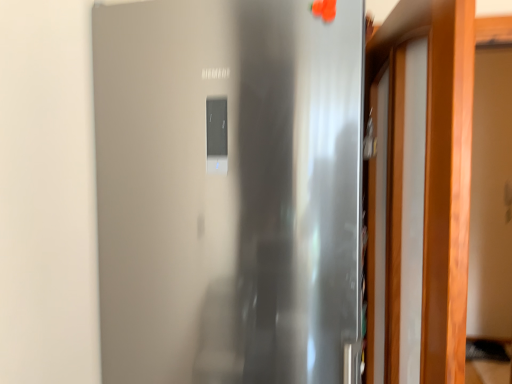
Question: Which direction should I rotate to face stainless steel refrigerator at center, which ranks as the second door in right-to-left order, — up or down?

Choices:
 (A) up
 (B) down

Answer: (B)

Question: Is wooden door at right, the first door when ordered from right to left, far away from stainless steel refrigerator at center, which ranks as the second door in right-to-left order?

Choices:
 (A) no
 (B) yes

Answer: (A)

Question: Is wooden door at right, the first door when ordered from right to left, turned away from stainless steel refrigerator at center, arranged as the 1th door when viewed from the left?

Choices:
 (A) yes
 (B) no

Answer: (A)

Question: From a real-world perspective, is wooden door at right, positioned as the second door in left-to-right order, located higher than stainless steel refrigerator at center, arranged as the 1th door when viewed from the left?

Choices:
 (A) no
 (B) yes

Answer: (B)

Question: Does wooden door at right, the first door when ordered from right to left, lie in front of stainless steel refrigerator at center, arranged as the 1th door when viewed from the left?

Choices:
 (A) no
 (B) yes

Answer: (B)

Question: Can you confirm if wooden door at right, the first door when ordered from right to left, is taller than stainless steel refrigerator at center, which ranks as the second door in right-to-left order?

Choices:
 (A) no
 (B) yes

Answer: (A)

Question: Is wooden door at right, positioned as the second door in left-to-right order, smaller than stainless steel refrigerator at center, arranged as the 1th door when viewed from the left?

Choices:
 (A) yes
 (B) no

Answer: (A)

Question: Can you confirm if stainless steel refrigerator at center, arranged as the 1th door when viewed from the left, is smaller than wooden door at right, the first door when ordered from right to left?

Choices:
 (A) yes
 (B) no

Answer: (B)

Question: Is stainless steel refrigerator at center, arranged as the 1th door when viewed from the left, positioned before wooden door at right, the first door when ordered from right to left?

Choices:
 (A) no
 (B) yes

Answer: (A)

Question: Could wooden door at right, the first door when ordered from right to left, be considered to be inside stainless steel refrigerator at center, arranged as the 1th door when viewed from the left?

Choices:
 (A) no
 (B) yes

Answer: (A)

Question: Are stainless steel refrigerator at center, arranged as the 1th door when viewed from the left, and wooden door at right, the first door when ordered from right to left, making contact?

Choices:
 (A) no
 (B) yes

Answer: (A)

Question: From the image's perspective, would you say stainless steel refrigerator at center, which ranks as the second door in right-to-left order, is positioned over wooden door at right, positioned as the second door in left-to-right order?

Choices:
 (A) no
 (B) yes

Answer: (A)

Question: From a real-world perspective, is stainless steel refrigerator at center, which ranks as the second door in right-to-left order, positioned under wooden door at right, the first door when ordered from right to left, based on gravity?

Choices:
 (A) yes
 (B) no

Answer: (A)

Question: Which is correct: wooden door at right, positioned as the second door in left-to-right order, is inside stainless steel refrigerator at center, which ranks as the second door in right-to-left order, or outside of it?

Choices:
 (A) inside
 (B) outside

Answer: (B)